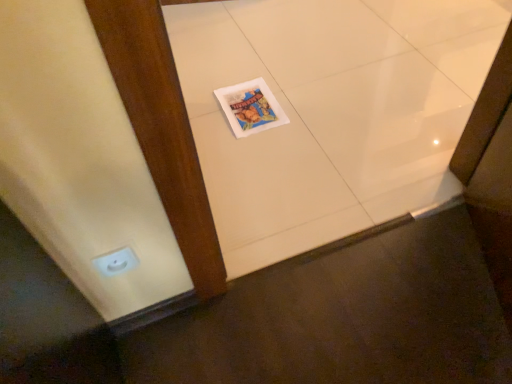
Question: Is matte paper magazine at center inside or outside of white glossy tile at center?

Choices:
 (A) outside
 (B) inside

Answer: (B)

Question: In terms of width, does matte paper magazine at center look wider or thinner when compared to white glossy tile at center?

Choices:
 (A) thin
 (B) wide

Answer: (A)

Question: Which of these objects is positioned closest to the white glossy tile at center?

Choices:
 (A) white glossy electric outlet at lower left
 (B) matte paper magazine at center

Answer: (B)

Question: Based on their relative distances, which object is nearer to the matte paper magazine at center?

Choices:
 (A) white glossy tile at center
 (B) white glossy electric outlet at lower left

Answer: (A)